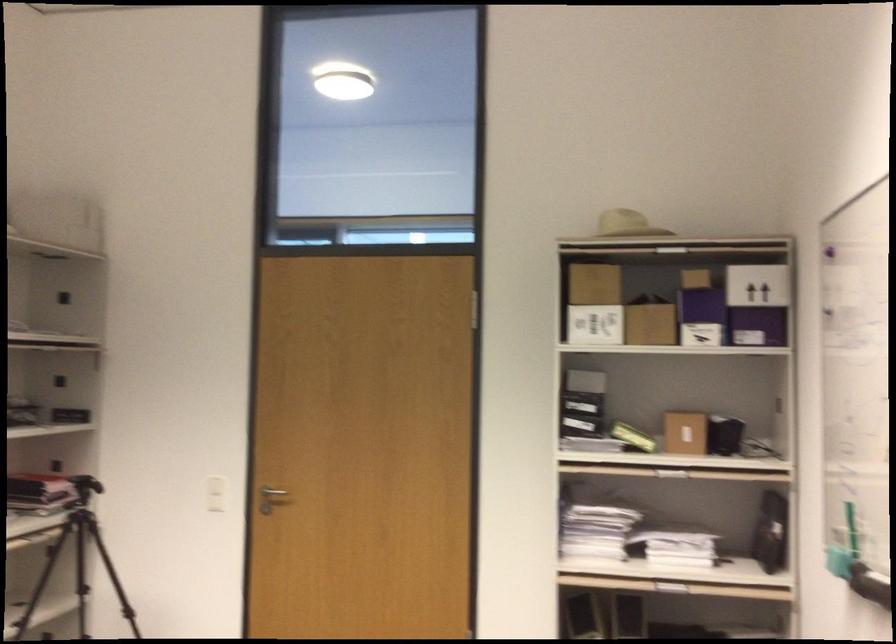
Where is `purple box`? The image size is (896, 644). purple box is located at coordinates click(x=702, y=317).